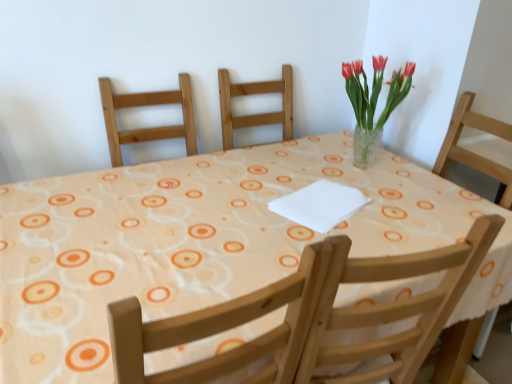
Question: From a real-world perspective, is clear glass vase at upper right physically located above or below wooden chair at upper center?

Choices:
 (A) below
 (B) above

Answer: (B)

Question: Considering their positions, is clear glass vase at upper right located in front of or behind wooden chair at upper center?

Choices:
 (A) front
 (B) behind

Answer: (B)

Question: Considering the real-world distances, which object is closest to the wooden chair at upper center?

Choices:
 (A) white fabric at center
 (B) clear glass vase at upper right

Answer: (A)

Question: Which is farther from the wooden chair at upper center?

Choices:
 (A) clear glass vase at upper right
 (B) white fabric at center

Answer: (A)